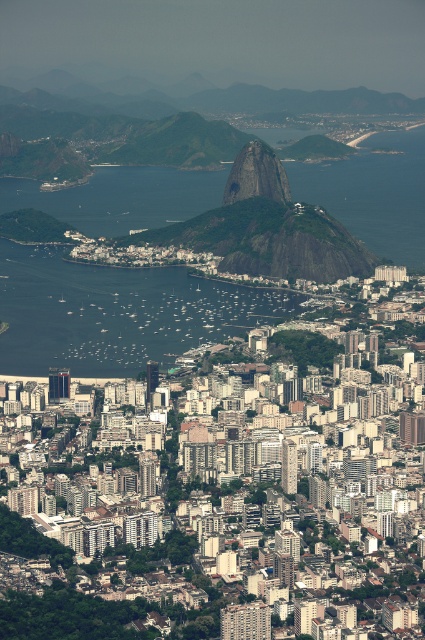
You are a drone operator trying to capture a photo of the clear blue water at center in Rio de Janeiro. According to the coordinates provided, where should you position the drone to ensure the water is centered in the frame?

The clear blue water at center is located at coordinates point (x=116, y=312), so the drone should be positioned to center the frame at those coordinates to capture the water accurately.

In the image of Rio de Janeiro, there is a point labeled as point [116,312]. What is located at this point?

The point [116,312] corresponds to clear blue water at center.

You are a tourist in Rio de Janeiro and want to take a photo of both the clear blue water at center and the green rock formation at center. Which one should you zoom in on to capture more details of the smaller object?

The green rock formation at center is smaller than the clear blue water at center, so you should zoom in on the green rock formation at center to capture more details of the smaller object.